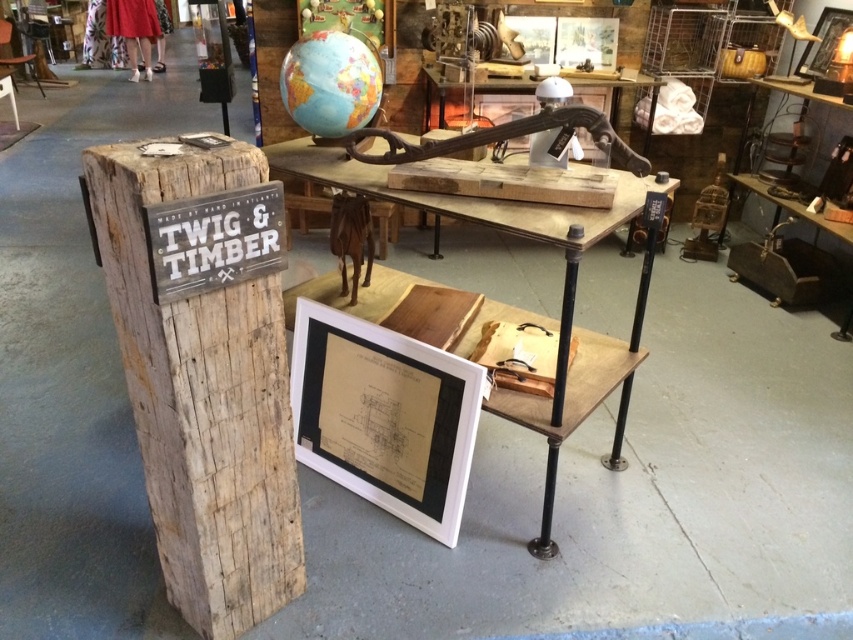
Between weathered wood sign at left and wooden at center, which one appears on the right side from the viewer's perspective?

wooden at center

Does weathered wood sign at left appear on the right side of wooden at center?

No, weathered wood sign at left is not to the right of wooden at center.

Locate an element on the screen. weathered wood sign at left is located at coordinates (202, 397).

Between wooden at center and blue and green globe at upper center, which one is positioned lower?

Positioned lower is wooden at center.

Is point (527, 404) closer to camera compared to point (361, 120)?

Yes, it is.

Between point (486, 212) and point (289, 100), which one is positioned behind?

Point (289, 100)

Where is `wooden at center`? The height and width of the screenshot is (640, 853). wooden at center is located at coordinates (515, 307).

Who is more distant from viewer, (175, 403) or (291, 45)?

Point (291, 45)

The image size is (853, 640). What do you see at coordinates (202, 397) in the screenshot? I see `weathered wood sign at left` at bounding box center [202, 397].

You are a GUI agent. You are given a task and a screenshot of the screen. Output one action in this format:
    pyautogui.click(x=<x>, y=<y>)
    Task: Click on the weathered wood sign at left
    This screenshot has height=640, width=853.
    Given the screenshot: What is the action you would take?
    pyautogui.click(x=202, y=397)